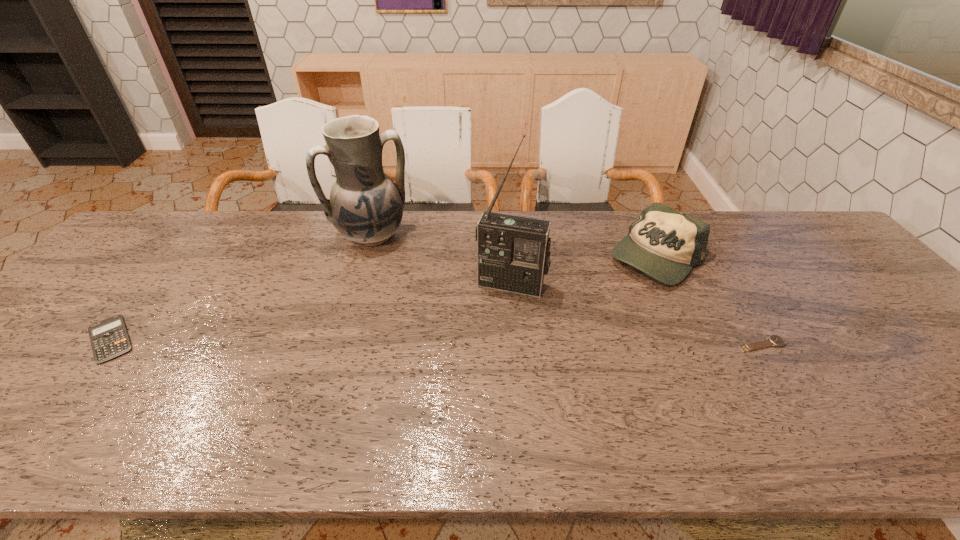
Where is `vacant space at the far edge of the desktop`? vacant space at the far edge of the desktop is located at coordinates (740, 227).

In the image, there is a desktop. Where is `vacant space at the near edge`? This screenshot has width=960, height=540. vacant space at the near edge is located at coordinates (883, 408).

In the image, there is a desktop. Where is `vacant space at the left edge`? vacant space at the left edge is located at coordinates (82, 351).

Locate an element on the screen. free region at the near left corner of the desktop is located at coordinates (40, 399).

Identify the location of vacant space at the far right corner of the desktop. (806, 251).

The width and height of the screenshot is (960, 540). Identify the location of free space between the leftmost object and the watch. (437, 342).

Image resolution: width=960 pixels, height=540 pixels. Identify the location of empty location between the third object from left to right and the pitcher. (442, 260).

Locate an element on the screen. This screenshot has height=540, width=960. free spot between the third object from left to right and the leftmost object is located at coordinates point(311,312).

This screenshot has width=960, height=540. Identify the location of vacant area that lies between the watch and the fourth object from right to left. (567, 290).

What are the coordinates of `blank region between the leftmost object and the baseball cap` in the screenshot? It's located at (383, 298).